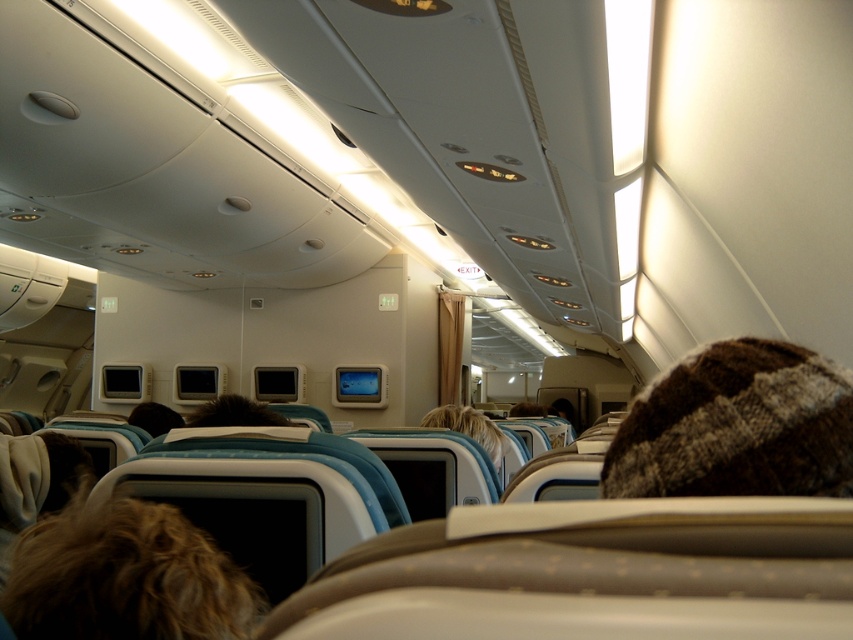
You are a flight attendant on an airplane. You need to retrieve a brown knitted hat that a passenger left behind. The hat is located at point (737, 426) in the cabin. The cabin has seats arranged in rows with overhead compartments. Can you determine if the brown knitted hat at upper right is closer to the front or the back of the airplane cabin?

The point (737, 426) indicates the brown knitted hat at upper right is located at the upper right of the cabin. Since the view is from the front, the upper right would place it closer to the back of the cabin.

You are sitting in an airplane seat and want to check if the brown fuzzy hair at lower left is within your reach. Your hand can extend 70 centimeters forward. Can you reach it?

The brown fuzzy hair at lower left is 68.20 centimeters away from the viewer. Since your hand can extend 70 centimeters, you can reach it.

You are a flight attendant on an airplane and need to locate a passenger with a brown knitted hat at upper right and another with brown fuzzy hair at lower left. Which passenger is sitting to the right side of the cabin?

The brown knitted hat at upper right is to the right of brown fuzzy hair at lower left, so the passenger with the brown knitted hat at upper right is sitting to the right side of the cabin.